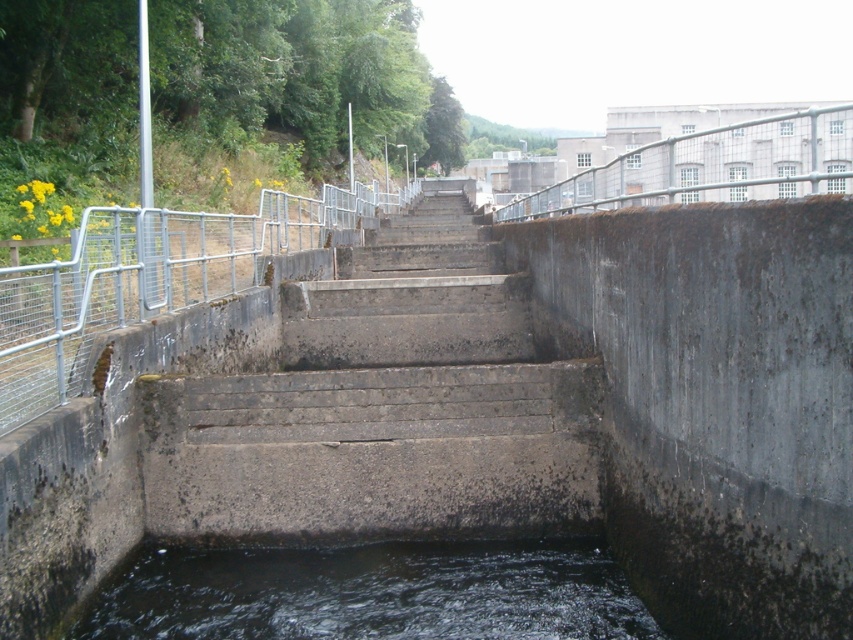
Based on the photo, is concrete stairs at center smaller than metallic gray rail at upper right?

Indeed, concrete stairs at center has a smaller size compared to metallic gray rail at upper right.

Is concrete stairs at center wider than metallic gray rail at upper right?

Incorrect, concrete stairs at center's width does not surpass metallic gray rail at upper right's.

Does point (314, 333) come behind point (583, 188)?

That is True.

This screenshot has width=853, height=640. I want to click on concrete stairs at center, so click(x=384, y=408).

Is concrete stairs at center closer to the viewer compared to dark gray water at bottom center?

No, concrete stairs at center is behind dark gray water at bottom center.

Is point (460, 525) closer to camera compared to point (138, 573)?

No, it is not.

Locate an element on the screen. The image size is (853, 640). concrete stairs at center is located at coordinates (384, 408).

Does dark gray water at bottom center have a smaller size compared to metallic gray rail at upper right?

Yes, dark gray water at bottom center is smaller than metallic gray rail at upper right.

The width and height of the screenshot is (853, 640). Describe the element at coordinates (370, 593) in the screenshot. I see `dark gray water at bottom center` at that location.

Which is behind, point (607, 584) or point (643, 141)?

Positioned behind is point (643, 141).

Locate an element on the screen. dark gray water at bottom center is located at coordinates (370, 593).